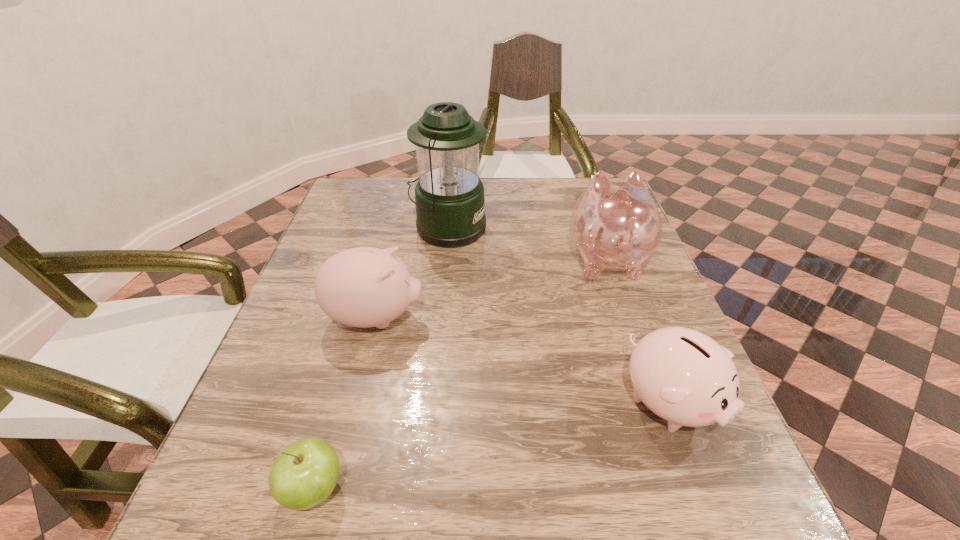
Identify the location of vacant space at the far edge. (505, 179).

In the image, there is a desktop. At what (x,y) coordinates should I click in order to perform the action: click on vacant space at the near edge. Please return your answer as a coordinate pair (x, y). Looking at the image, I should click on (507, 503).

The width and height of the screenshot is (960, 540). I want to click on vacant region at the left edge of the desktop, so click(x=334, y=230).

You are a GUI agent. You are given a task and a screenshot of the screen. Output one action in this format:
    pyautogui.click(x=<x>, y=<y>)
    Task: Click on the vacant space at the right edge
    
    Given the screenshot: What is the action you would take?
    pyautogui.click(x=675, y=314)

The height and width of the screenshot is (540, 960). In the image, there is a desktop. Find the location of `vacant space at the far right corner`. vacant space at the far right corner is located at coordinates (581, 179).

Locate an element on the screen. This screenshot has width=960, height=540. vacant area at the near right corner of the desktop is located at coordinates (710, 510).

You are a GUI agent. You are given a task and a screenshot of the screen. Output one action in this format:
    pyautogui.click(x=<x>, y=<y>)
    Task: Click on the unoccupied position between the leftmost piggy bank and the nearest piggy bank
    The image size is (960, 540).
    Given the screenshot: What is the action you would take?
    pyautogui.click(x=522, y=360)

Identify the location of free space between the second farthest piggy bank and the apple. (345, 403).

The height and width of the screenshot is (540, 960). I want to click on vacant point located between the tallest piggy bank and the nearest piggy bank, so click(637, 330).

Find the location of a particular element. free space that is in between the tallest object and the second nearest object is located at coordinates (559, 315).